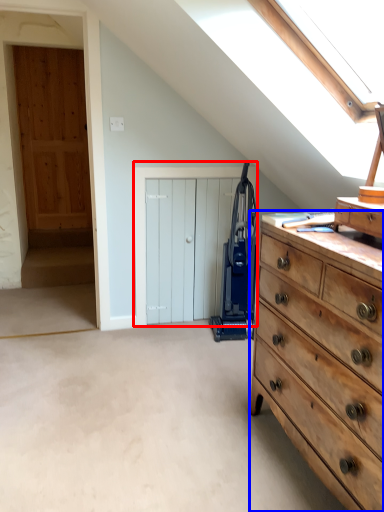
Question: Among these objects, which one is farthest to the camera, door (highlighted by a red box) or chest of drawers (highlighted by a blue box)?

Choices:
 (A) door
 (B) chest of drawers

Answer: (A)